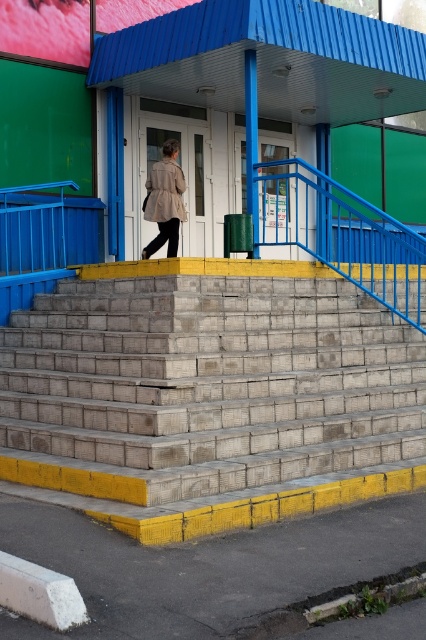
Question: Which object appears farthest from the camera in this image?

Choices:
 (A) blue metal/rail at upper center
 (B) concrete stairs at center
 (C) beige textured coat at center

Answer: (A)

Question: Observing the image, what is the correct spatial positioning of blue metal/rail at upper center in reference to beige textured coat at center?

Choices:
 (A) above
 (B) below

Answer: (B)

Question: Which of the following is the farthest from the observer?

Choices:
 (A) beige textured coat at center
 (B) blue metal/rail at upper center

Answer: (B)

Question: Which point appears closest to the camera in this image?

Choices:
 (A) (144, 186)
 (B) (354, 196)

Answer: (B)

Question: Is the position of concrete stairs at center more distant than that of blue metal/rail at upper center?

Choices:
 (A) no
 (B) yes

Answer: (A)

Question: Is blue metal/rail at upper center below beige textured coat at center?

Choices:
 (A) yes
 (B) no

Answer: (A)